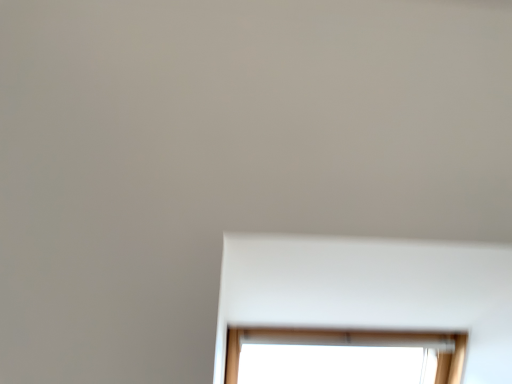
Question: Should I look upward or downward to see transparent glass window at center?

Choices:
 (A) down
 (B) up

Answer: (A)

Question: Is the depth of white matte bay window at lower center less than that of transparent glass window at center?

Choices:
 (A) yes
 (B) no

Answer: (A)

Question: Is white matte bay window at lower center not within transparent glass window at center?

Choices:
 (A) yes
 (B) no

Answer: (A)

Question: Is transparent glass window at center a part of white matte bay window at lower center?

Choices:
 (A) no
 (B) yes

Answer: (A)

Question: From a real-world perspective, is white matte bay window at lower center located higher than transparent glass window at center?

Choices:
 (A) no
 (B) yes

Answer: (B)

Question: From the image's perspective, does white matte bay window at lower center appear lower than transparent glass window at center?

Choices:
 (A) yes
 (B) no

Answer: (B)

Question: Is white matte bay window at lower center placed right next to transparent glass window at center?

Choices:
 (A) no
 (B) yes

Answer: (A)

Question: Is white matte bay window at lower center located within transparent glass window at center?

Choices:
 (A) no
 (B) yes

Answer: (A)

Question: Is transparent glass window at center next to white matte bay window at lower center?

Choices:
 (A) no
 (B) yes

Answer: (A)

Question: Is transparent glass window at center located outside white matte bay window at lower center?

Choices:
 (A) no
 (B) yes

Answer: (B)

Question: From the image's perspective, is transparent glass window at center above white matte bay window at lower center?

Choices:
 (A) no
 (B) yes

Answer: (A)

Question: Can you confirm if transparent glass window at center is thinner than white matte bay window at lower center?

Choices:
 (A) no
 (B) yes

Answer: (B)

Question: Does transparent glass window at center have a greater width compared to white matte bay window at lower center?

Choices:
 (A) no
 (B) yes

Answer: (A)

Question: In the image, is white matte bay window at lower center on the left side or the right side of transparent glass window at center?

Choices:
 (A) right
 (B) left

Answer: (A)